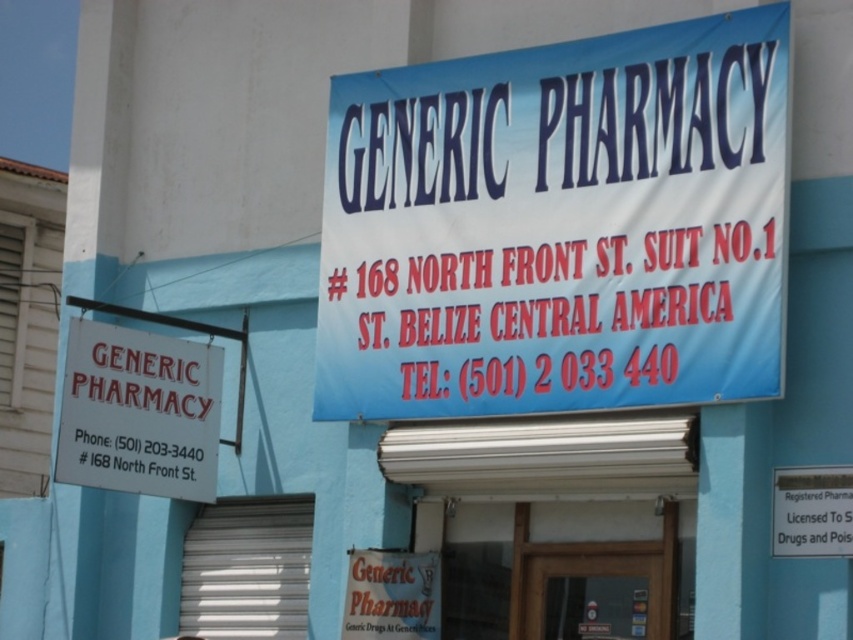
You are a customer standing in front of the pharmacy building. You notice two signs above the entrance. Which one is wider, the blue fabric sign at upper center or the white paper sign at upper left?

The blue fabric sign at upper center might be wider than the white paper sign at upper left.

You are a customer looking for the pharmacy entrance. You see a blue fabric sign at upper center and a white paper sign at upper left. Which sign is closer to the left side of the entrance?

The white paper sign at upper left is closer to the left side of the entrance because it is positioned to the left of the blue fabric sign at upper center.